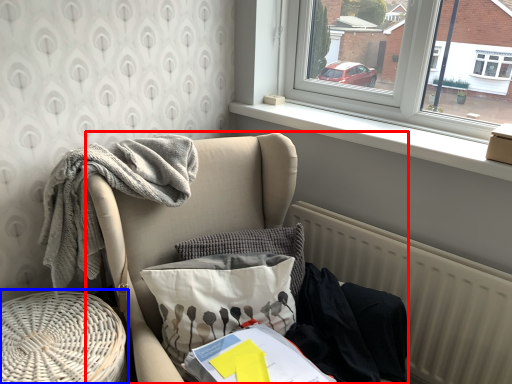
Question: Among these objects, which one is farthest to the camera, furniture (highlighted by a red box) or side table (highlighted by a blue box)?

Choices:
 (A) furniture
 (B) side table

Answer: (B)